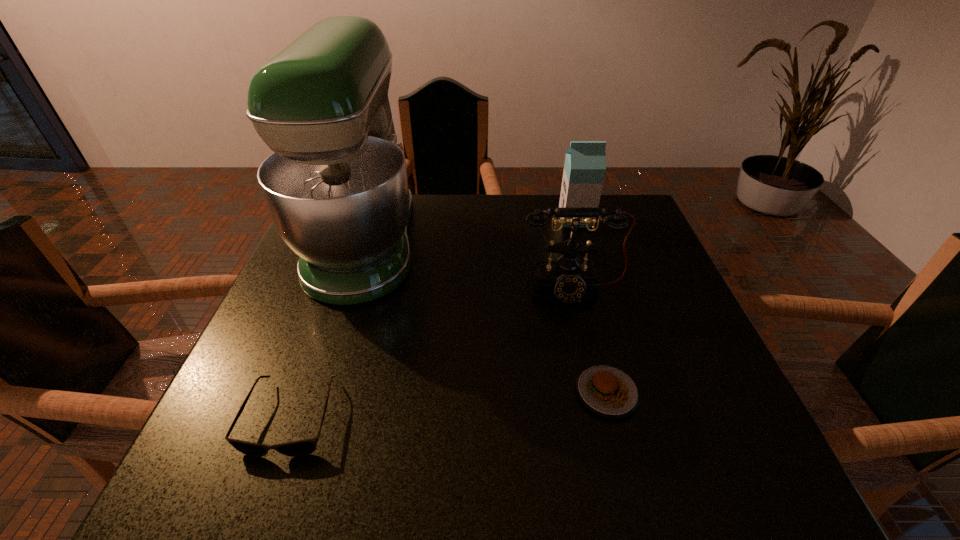
At what (x,y) coordinates should I click in order to perform the action: click on milk carton situated at the far edge. Please return your answer as a coordinate pair (x, y). Looking at the image, I should click on (585, 162).

I want to click on object that is at the near edge, so click(x=304, y=447).

Identify the location of mixer at the left edge. The image size is (960, 540). (336, 186).

Locate an element on the screen. sunglasses that is at the left edge is located at coordinates (304, 447).

Identify the location of milk carton that is at the right edge. (585, 162).

Find the location of a particular element. The height and width of the screenshot is (540, 960). telephone located at the right edge is located at coordinates (568, 278).

The width and height of the screenshot is (960, 540). What are the coordinates of `object at the far left corner` in the screenshot? It's located at (336, 186).

Locate an element on the screen. object that is at the near left corner is located at coordinates coord(304,447).

You are a GUI agent. You are given a task and a screenshot of the screen. Output one action in this format:
    pyautogui.click(x=<x>, y=<y>)
    Task: Click on the object at the far right corner
    The height and width of the screenshot is (540, 960).
    Given the screenshot: What is the action you would take?
    tap(585, 162)

The height and width of the screenshot is (540, 960). I want to click on vacant point at the far edge, so click(x=490, y=211).